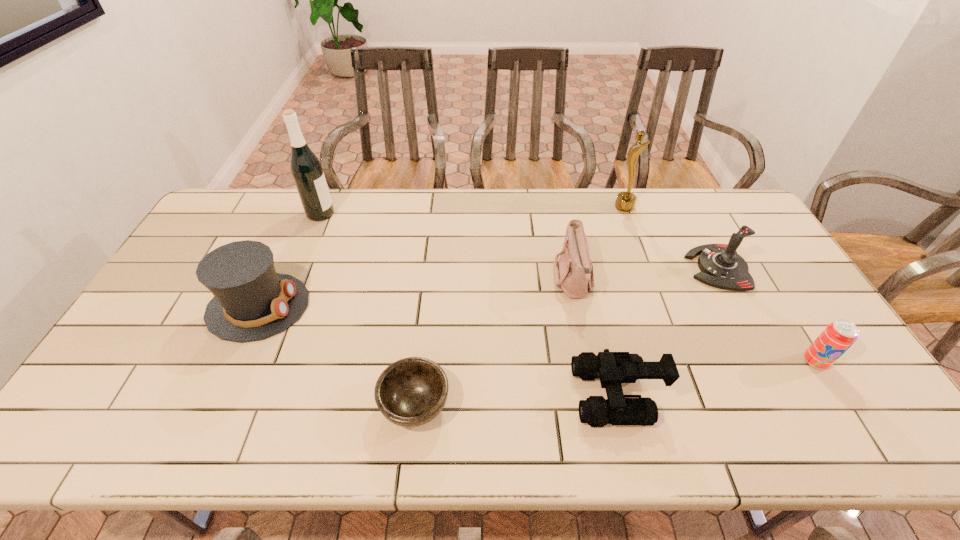
Image resolution: width=960 pixels, height=540 pixels. I want to click on vacant space that satisfies the following two spatial constraints: 1. on the label of the shortest object; 2. on the right side of the tallest object, so click(x=243, y=404).

The height and width of the screenshot is (540, 960). Identify the location of vacant space that satisfies the following two spatial constraints: 1. with goggles on the front of the dress hat; 2. on the back side of the bowl. (214, 404).

Where is `vacant space that satisfies the following two spatial constraints: 1. on the back side of the soda can; 2. on the handle side of the second object from right to left`? vacant space that satisfies the following two spatial constraints: 1. on the back side of the soda can; 2. on the handle side of the second object from right to left is located at coordinates (757, 268).